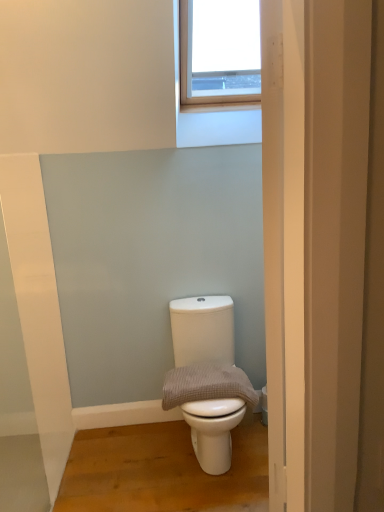
Question: Does white matte toilet at center lie behind waffle-textured towel at center?

Choices:
 (A) no
 (B) yes

Answer: (A)

Question: Considering the relative sizes of white matte toilet at center and waffle-textured towel at center in the image provided, is white matte toilet at center thinner than waffle-textured towel at center?

Choices:
 (A) no
 (B) yes

Answer: (A)

Question: Would you say white matte toilet at center is a long distance from waffle-textured towel at center?

Choices:
 (A) no
 (B) yes

Answer: (A)

Question: Considering the relative sizes of white matte toilet at center and waffle-textured towel at center in the image provided, is white matte toilet at center smaller than waffle-textured towel at center?

Choices:
 (A) no
 (B) yes

Answer: (A)

Question: From the image's perspective, is white matte toilet at center on top of waffle-textured towel at center?

Choices:
 (A) yes
 (B) no

Answer: (B)

Question: Is white matte toilet at center oriented towards waffle-textured towel at center?

Choices:
 (A) no
 (B) yes

Answer: (B)

Question: Can you confirm if waffle-textured towel at center is positioned to the left of white matte toilet at center?

Choices:
 (A) no
 (B) yes

Answer: (B)

Question: Is waffle-textured towel at center far from white matte toilet at center?

Choices:
 (A) yes
 (B) no

Answer: (B)

Question: Is waffle-textured towel at center positioned with its back to white matte toilet at center?

Choices:
 (A) yes
 (B) no

Answer: (A)

Question: From a real-world perspective, is waffle-textured towel at center physically below white matte toilet at center?

Choices:
 (A) no
 (B) yes

Answer: (A)

Question: Considering the relative sizes of waffle-textured towel at center and white matte toilet at center in the image provided, is waffle-textured towel at center taller than white matte toilet at center?

Choices:
 (A) no
 (B) yes

Answer: (A)

Question: Does waffle-textured towel at center turn towards white matte toilet at center?

Choices:
 (A) no
 (B) yes

Answer: (B)

Question: From the image's perspective, is white matte toilet at center positioned above or below waffle-textured towel at center?

Choices:
 (A) above
 (B) below

Answer: (B)